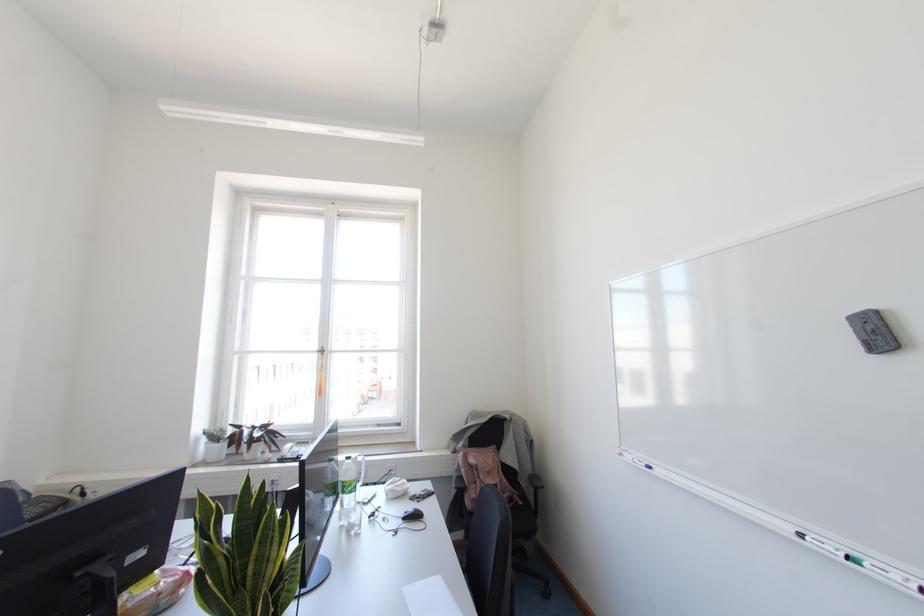
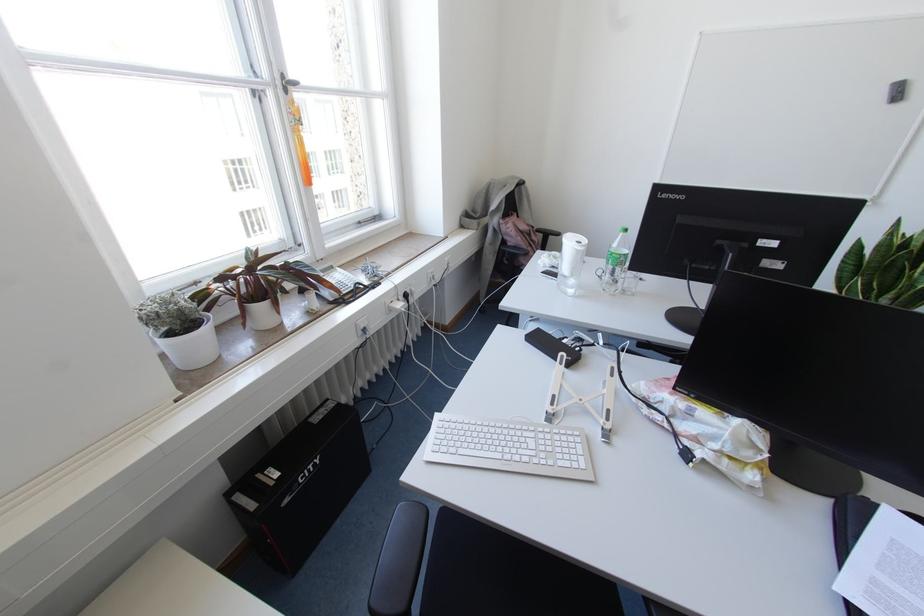
The point at [322,353] is marked in the first image. Where is the corresponding point in the second image?

(285, 90)